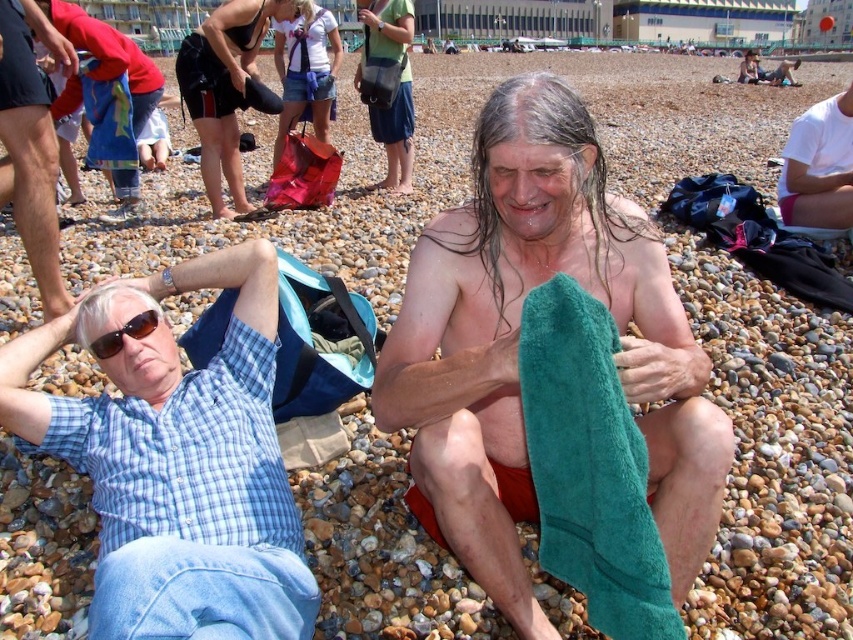
Question: Which point is closer to the camera?

Choices:
 (A) white cotton shirt at upper right
 (B) matte black bag at center

Answer: (A)

Question: Which of the following is the farthest from the observer?

Choices:
 (A) (564, 275)
 (B) (392, 61)
 (C) (80, 96)

Answer: (B)

Question: Among these points, which one is nearest to the camera?

Choices:
 (A) (33, 154)
 (B) (128, 541)

Answer: (B)

Question: Is green towel at center above blue plaid shirt at upper left?

Choices:
 (A) yes
 (B) no

Answer: (B)

Question: Can you confirm if blue plaid shirt at upper left is thinner than white cotton shirt at upper right?

Choices:
 (A) no
 (B) yes

Answer: (B)

Question: Can you confirm if blue denim shorts at center is positioned above brown plastic sunglasses at upper left?

Choices:
 (A) no
 (B) yes

Answer: (B)